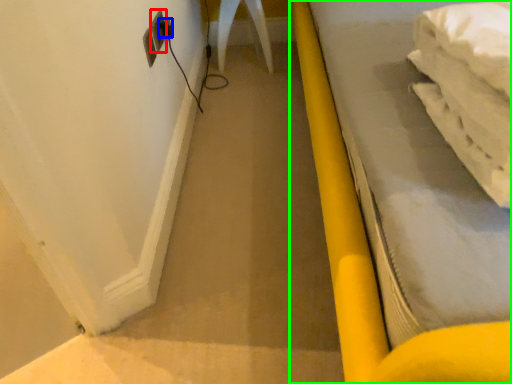
Question: Estimate the real-world distances between objects in this image. Which object is closer to electric outlet (highlighted by a red box), plug (highlighted by a blue box) or furniture (highlighted by a green box)?

Choices:
 (A) plug
 (B) furniture

Answer: (A)